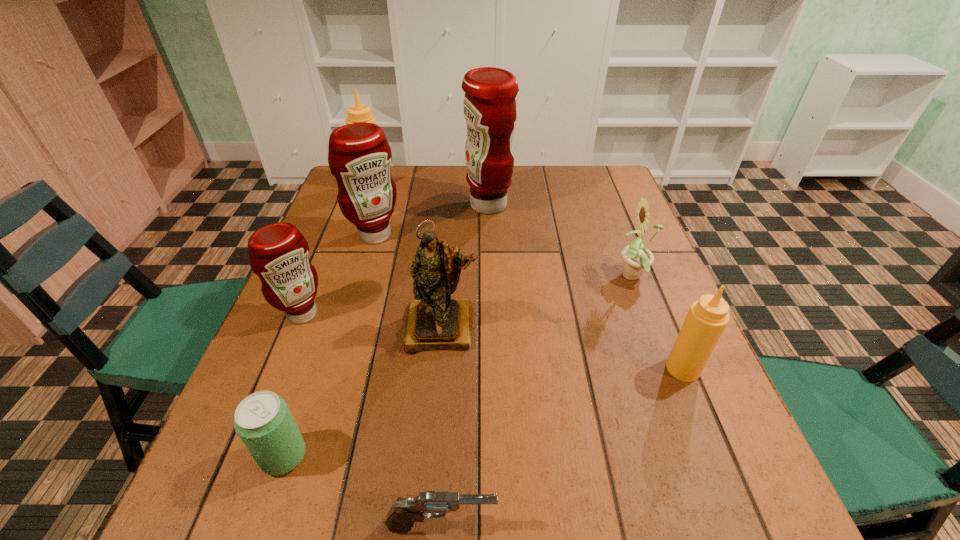
Find the location of a particular element. unoccupied position between the smaller tan condiment and the fourth farthest object is located at coordinates coord(659,323).

At what (x,y) coordinates should I click in order to perform the action: click on free space between the nearest condiment and the soda. Please return your answer as a coordinate pair (x, y). Looking at the image, I should click on (484, 412).

Where is `vacant point located between the smallest red condiment and the tallest condiment`? The image size is (960, 540). vacant point located between the smallest red condiment and the tallest condiment is located at coordinates (396, 260).

Locate an element on the screen. This screenshot has height=540, width=960. free space between the rightmost condiment and the sixth nearest object is located at coordinates (659, 323).

I want to click on vacant area that lies between the bigger tan condiment and the gold figurine, so click(x=407, y=256).

I want to click on object that is the eighth closest to the second biggest red condiment, so 707,318.

Locate which object is the fifth closest to the rightmost condiment. Please provide its 2D coordinates. Your answer should be formatted as a tuple, i.e. [(x, y)], where the tuple contains the x and y coordinates of a point satisfying the conditions above.

[(265, 425)]

Identify which condiment is the fourth nearest to the seventh farthest object. Please provide its 2D coordinates. Your answer should be formatted as a tuple, i.e. [(x, y)], where the tuple contains the x and y coordinates of a point satisfying the conditions above.

[(359, 113)]

Select which condiment is the third closest to the fourth condiment from left to right. Please provide its 2D coordinates. Your answer should be formatted as a tuple, i.e. [(x, y)], where the tuple contains the x and y coordinates of a point satisfying the conditions above.

[(278, 253)]

Where is `red condiment that is the nearest to the rightmost condiment`? red condiment that is the nearest to the rightmost condiment is located at coordinates click(490, 111).